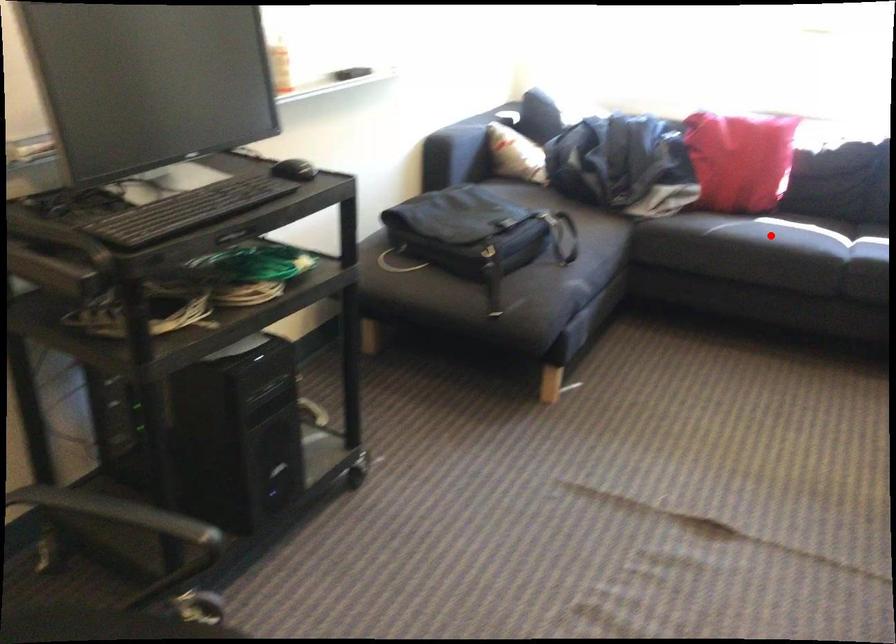
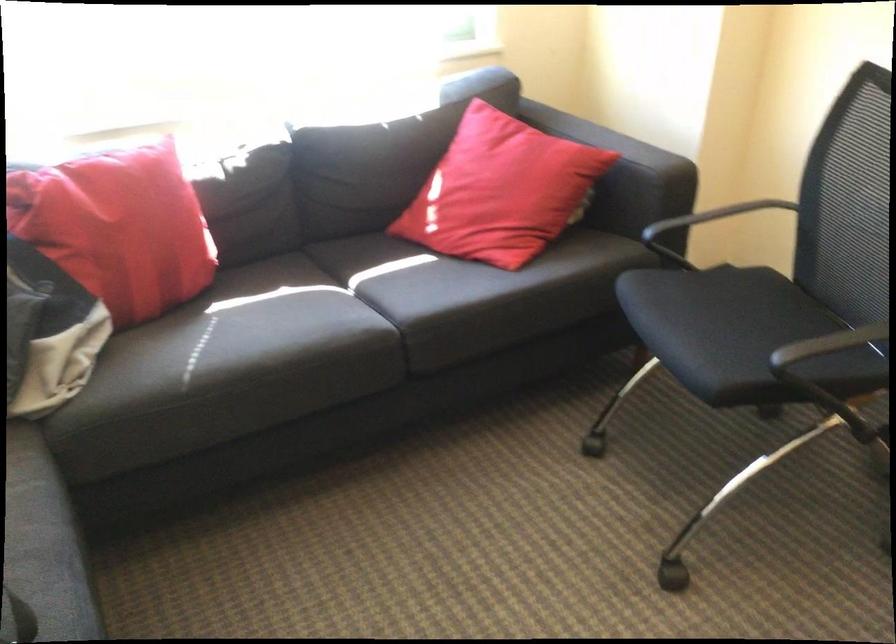
Question: I am providing you with two images of the same scene from different viewpoints. Image1 has a red point marked. In image2, the corresponding 3D location appears at what relative position? Reply with the corresponding letter.

Choices:
 (A) Closer
 (B) Farther

Answer: (A)